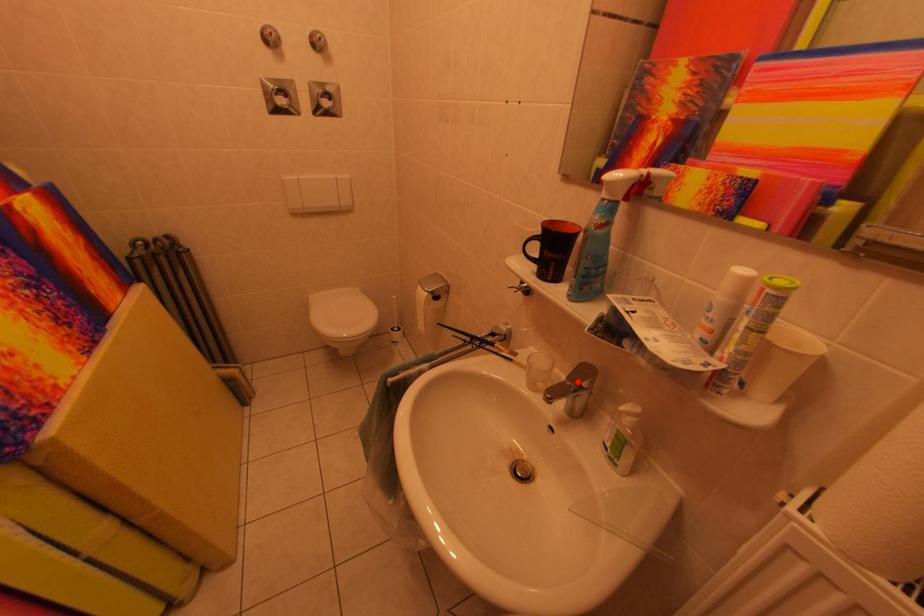
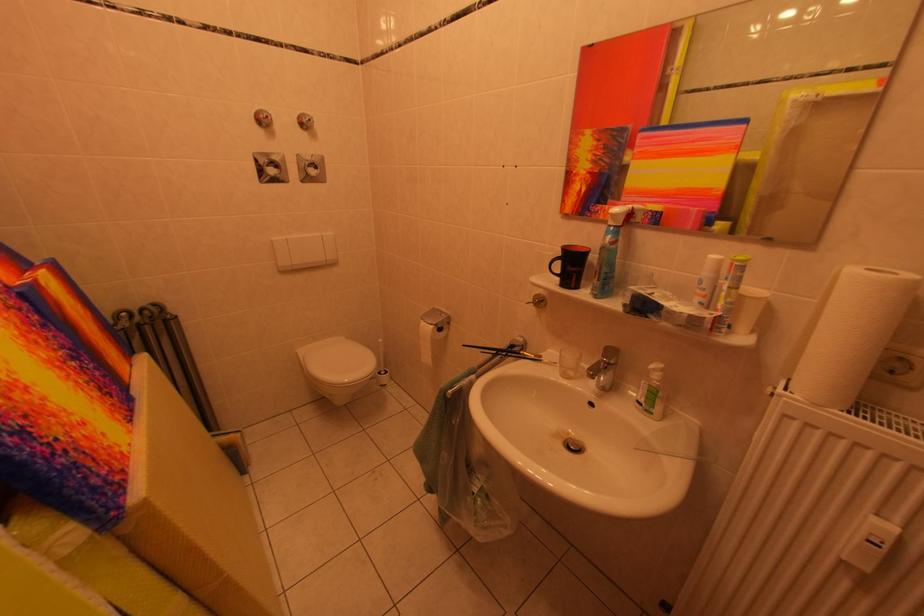
In the second image, find the point that corresponds to the highlighted location in the first image.

(612, 360)